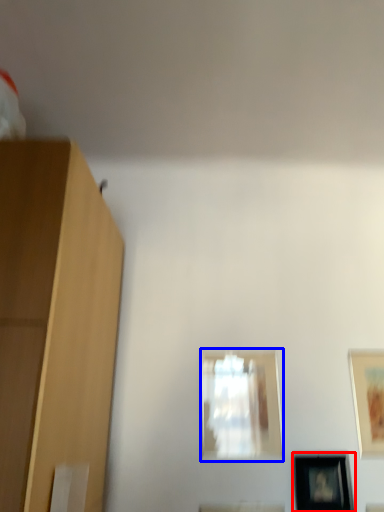
Question: Which object appears closest to the camera in this image, picture frame (highlighted by a red box) or picture frame (highlighted by a blue box)?

Choices:
 (A) picture frame
 (B) picture frame

Answer: (A)